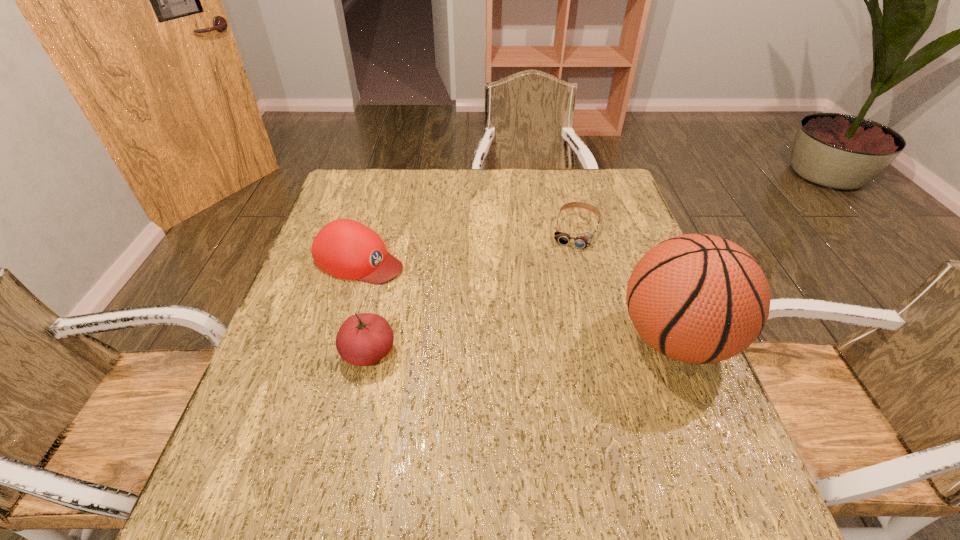
Identify the location of tomato. The height and width of the screenshot is (540, 960). (363, 339).

Locate an element on the screen. This screenshot has width=960, height=540. the tallest object is located at coordinates (697, 298).

Locate an element on the screen. The width and height of the screenshot is (960, 540). baseball cap is located at coordinates (344, 248).

Where is `goggles`? goggles is located at coordinates (584, 240).

Identify the location of vacant space located 0.140m on the front of the tomato. (349, 440).

Identify the location of vacant region located 0.350m on the front-facing side of the baseball cap. (516, 322).

The image size is (960, 540). Find the location of `vacant space located 0.360m on the front-facing side of the baseball cap`. vacant space located 0.360m on the front-facing side of the baseball cap is located at coordinates (520, 323).

Locate an element on the screen. This screenshot has height=540, width=960. free space located 0.220m on the front-facing side of the baseball cap is located at coordinates (468, 302).

You are a GUI agent. You are given a task and a screenshot of the screen. Output one action in this format:
    pyautogui.click(x=<x>, y=<y>)
    Task: Click on the free spot located on the front-facing side of the shortest object
    The height and width of the screenshot is (540, 960).
    Given the screenshot: What is the action you would take?
    pyautogui.click(x=560, y=286)

Locate an element on the screen. The width and height of the screenshot is (960, 540). free space located 0.060m on the front-facing side of the shortest object is located at coordinates (567, 263).